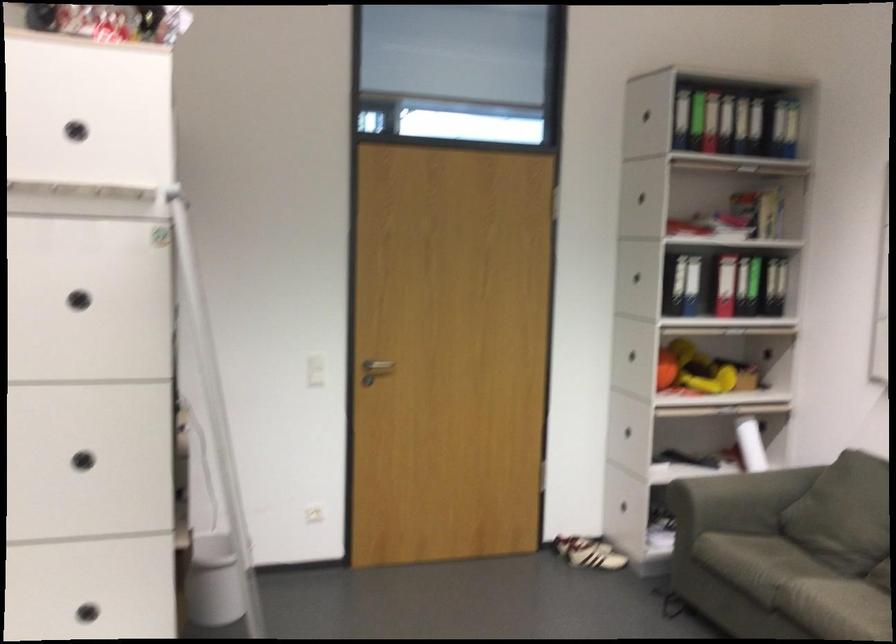
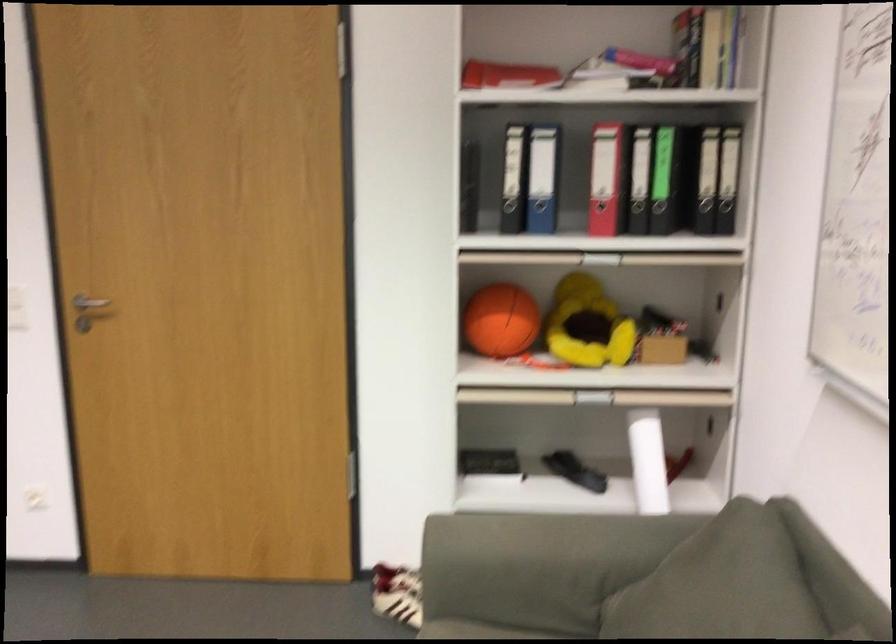
Where in the second image is the point corresponding to point 633,458 from the first image?

(489, 464)